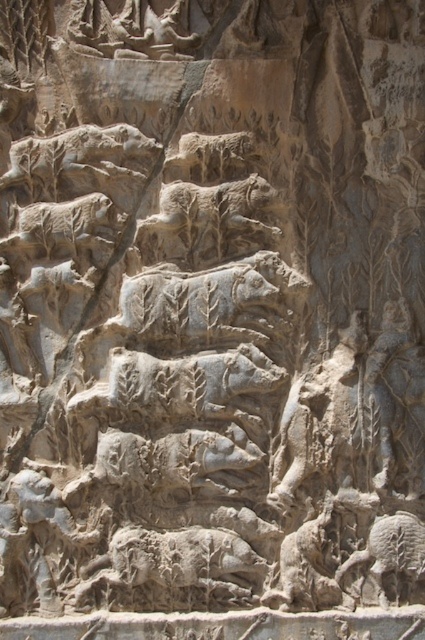
Does gray stone lion at center have a greater height compared to gray stone boar at center?

Correct, gray stone lion at center is much taller as gray stone boar at center.

This screenshot has width=425, height=640. What do you see at coordinates (209, 221) in the screenshot? I see `gray stone lion at center` at bounding box center [209, 221].

Image resolution: width=425 pixels, height=640 pixels. I want to click on gray stone lion at center, so click(x=209, y=221).

I want to click on gray stone boar at center, so click(189, 381).

Is point (155, 376) positioned behind point (229, 168)?

That is False.

Identify the location of gray stone boar at center. (189, 381).

Between gray stone lion at center and gray stone lion at upper center, which one appears on the left side from the viewer's perspective?

Positioned to the left is gray stone lion at center.

Which of these two, gray stone lion at center or gray stone lion at upper center, stands shorter?

Standing shorter between the two is gray stone lion at upper center.

Identify the location of gray stone lion at center. The width and height of the screenshot is (425, 640). (209, 221).

Identify the location of gray stone lion at center. coord(209,221).